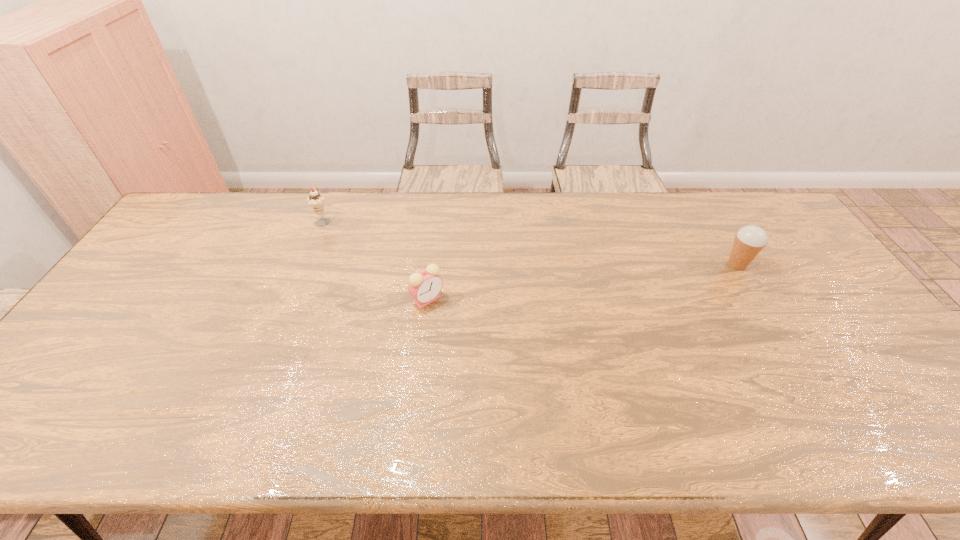
At what (x,y) coordinates should I click in order to perform the action: click on free point between the second object from left to right and the left icecream. Please return your answer as a coordinate pair (x, y). Looking at the image, I should click on (375, 260).

At what (x,y) coordinates should I click in order to perform the action: click on free space between the right icecream and the second object from right to left. Please return your answer as a coordinate pair (x, y). This screenshot has height=540, width=960. Looking at the image, I should click on (583, 282).

Identify the location of unoccupied area between the farther icecream and the right icecream. (530, 242).

Locate an element on the screen. The height and width of the screenshot is (540, 960). free space between the left icecream and the second object from left to right is located at coordinates (375, 260).

The image size is (960, 540). I want to click on empty location between the right icecream and the alarm clock, so click(583, 282).

Find the location of a particular element. This screenshot has width=960, height=540. vacant area between the farther icecream and the right icecream is located at coordinates (530, 242).

Image resolution: width=960 pixels, height=540 pixels. Identify the location of object identified as the second closest to the second object from right to left. (749, 241).

Identify the location of the second closest object to the left icecream. The width and height of the screenshot is (960, 540). (749, 241).